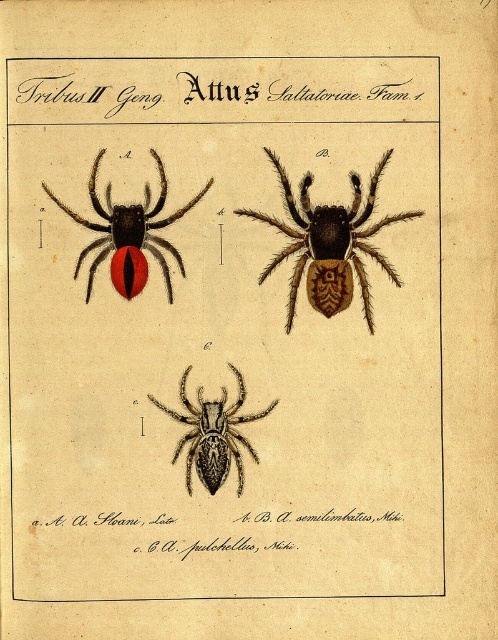
Based on the provided illustration, which spider is placed above the other between the matte black spider at upper left and the black textured spider at center?

The matte black spider at upper left is positioned over the black textured spider at center.

You are an entomologist examining the illustration. You notice two points marked in the image. The first point is at coordinates point (338, 225) and the second is at point (93, 188). Which of these points is closer to your eyes as you look at the illustration?

Point (338, 225) is further to the viewer than point (93, 188), so the point closer to your eyes is point (338, 225).